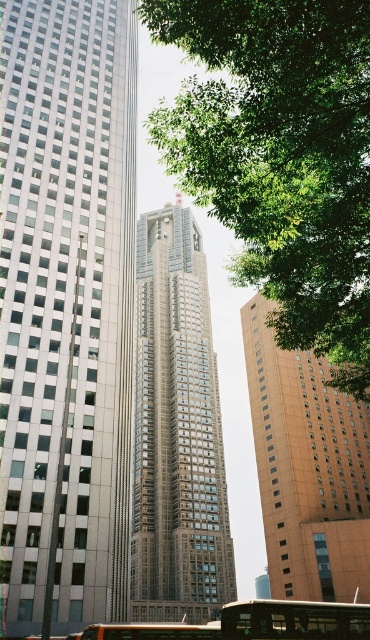
Based on the scene description, what does the point at coordinates (307,467) represent?

The point at coordinates (307,467) indicates the orange brick building at center.

You are a city planner assessing the visibility of a new billboard. The billboard will be placed between the green leafy tree at upper center and the metallic silver bus at center. Considering their heights, which object might block the billboard from being seen by someone standing on the opposite side of the street?

The green leafy tree at upper center, which is taller than the metallic silver bus at center, might block the billboard from being seen since it has a greater height.

You are standing in the city and see the orange brick building at center and the metallic silver bus at center. Which one is closer to you?

The orange brick building at center is closer to you because it is further to the viewer than the metallic silver bus at center.